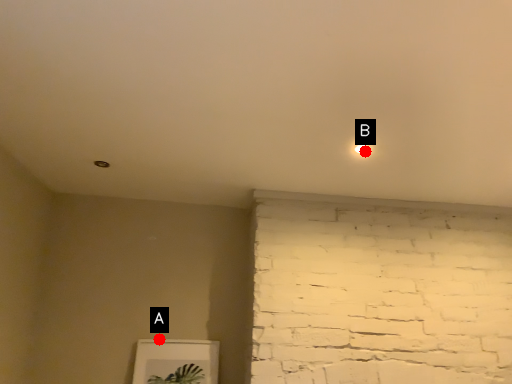
Question: Two points are circled on the image, labeled by A and B beside each circle. Which point is farther to the camera?

Choices:
 (A) A is further
 (B) B is further

Answer: (A)